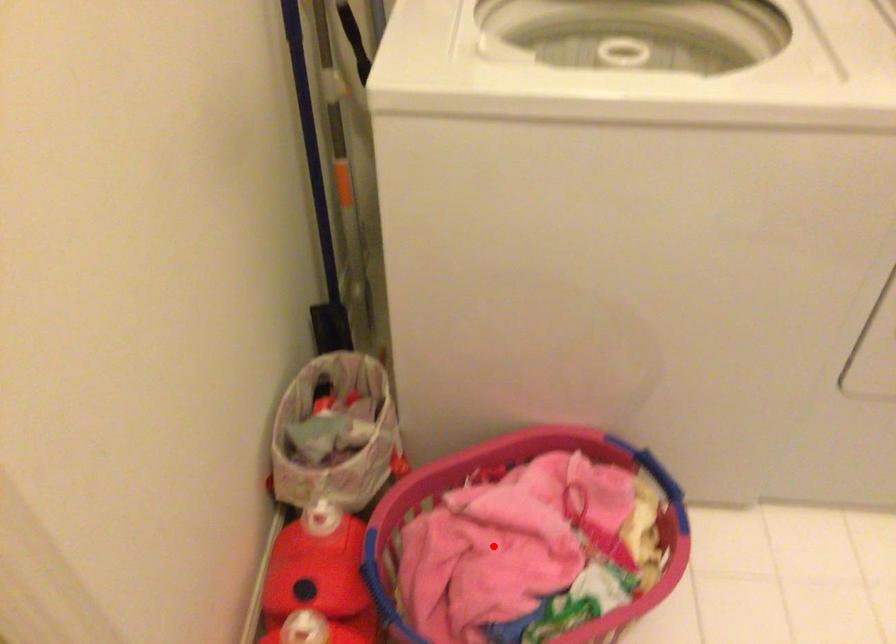
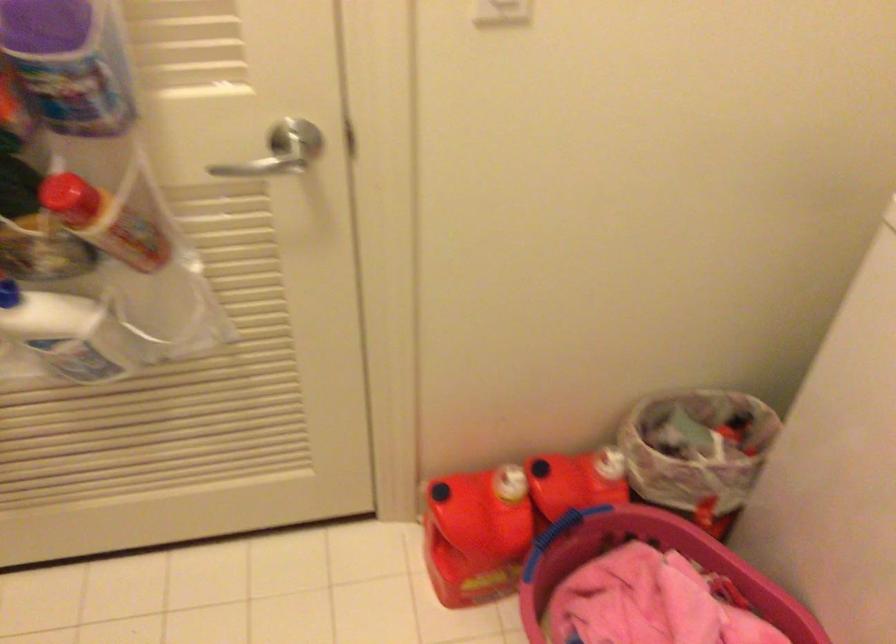
Find the pixel in the second image that matches the highlighted location in the first image.

(651, 603)